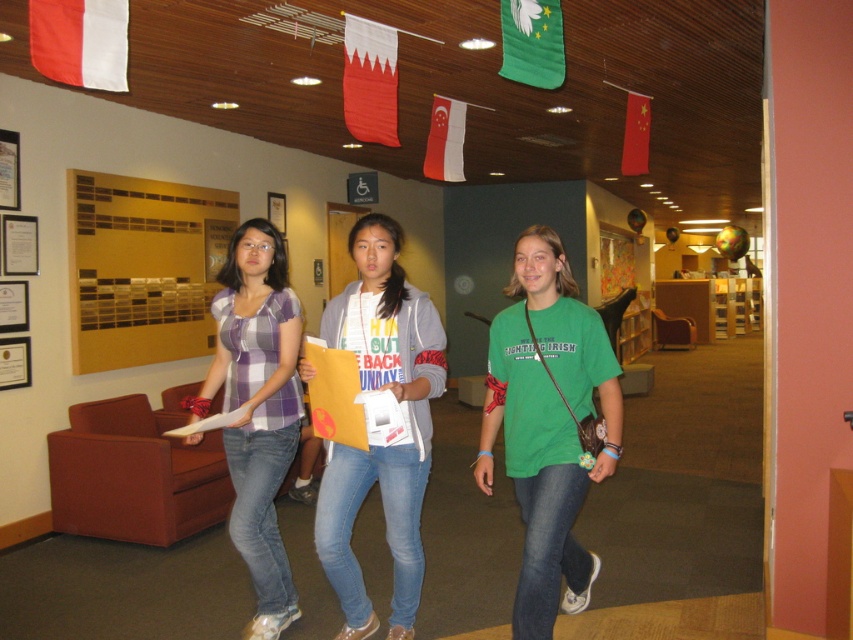
You are standing at point (x=439, y=381) and want to move to point (x=546, y=376). Is the destination point behind you or in front of you?

The destination point (x=546, y=376) is behind point (x=439, y=381), so it is behind you.

In the scene shown: What are the coordinates of the denim jeans at center?

The coordinates of the denim jeans at center are at point (383, 440).